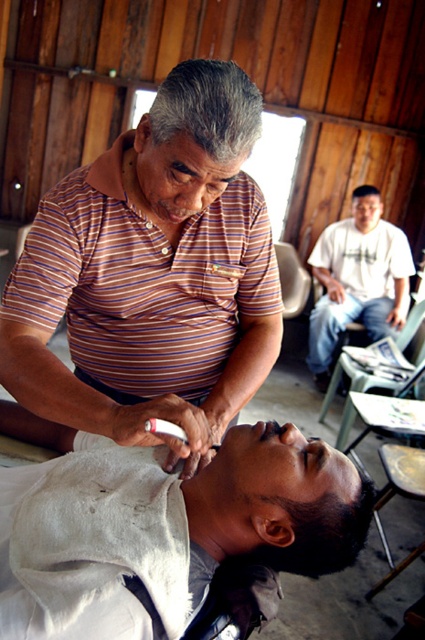
Please look at the image and identify the object located at the coordinates point [167,531]. Which object is it?

The point [167,531] marks the white cloth at lower center.

Based on the photo, you are a tailor measuring the distance between the striped cotton shirt at center and the edge of the wooden structure. The edge is 40 inches away from you. Can the shirt be moved to the edge without exceeding the space?

The striped cotton shirt at center is 37.23 inches from the viewer, which is within the 40 inches distance to the edge of the wooden structure. Therefore, the shirt can be moved to the edge without exceeding the space.

You are a customer in this barbershop and you want to place a 3.5 meter long scarf between the white cloth at lower center and the white cotton shirt at upper right. Is there enough space to fit the scarf between them?

The distance between the white cloth at lower center and the white cotton shirt at upper right is 3.33 meters, which is shorter than the 3.5 meter scarf. Therefore, the scarf cannot fit between them.